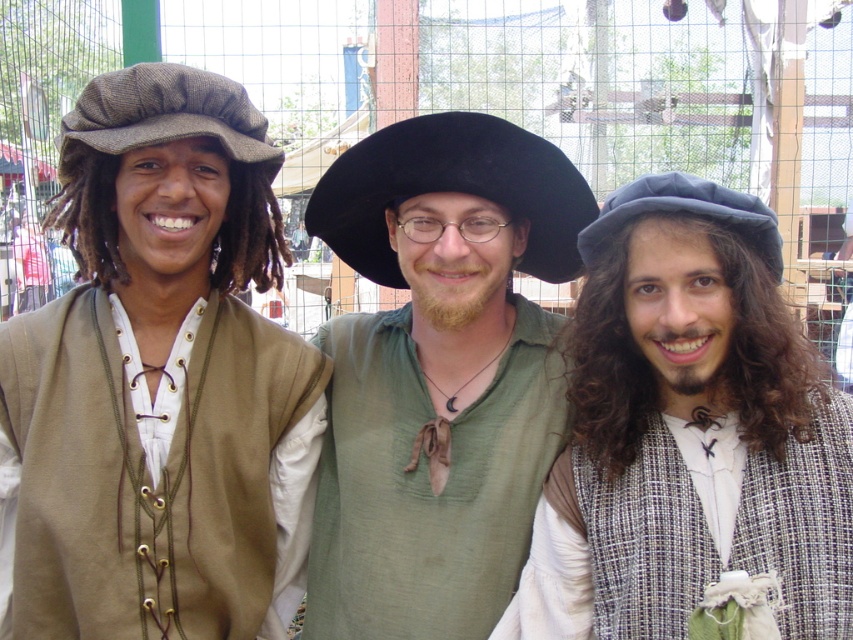
Question: Is matte green vest at center closer to the viewer compared to dark blue fabric hat at center?

Choices:
 (A) no
 (B) yes

Answer: (A)

Question: Which point is closer to the camera?

Choices:
 (A) brown woolen cap at left
 (B) black felt hat at center
 (C) dark blue fabric hat at center

Answer: (C)

Question: Among these points, which one is nearest to the camera?

Choices:
 (A) (741, 227)
 (B) (346, 156)
 (C) (534, 236)

Answer: (A)

Question: Observing the image, what is the correct spatial positioning of brown woolen cap at left in reference to dark blue fabric hat at center?

Choices:
 (A) above
 (B) below

Answer: (A)

Question: Considering the relative positions of matte green vest at center and dark blue fabric hat at center in the image provided, where is matte green vest at center located with respect to dark blue fabric hat at center?

Choices:
 (A) left
 (B) right

Answer: (A)

Question: Which of the following is the farthest from the observer?

Choices:
 (A) (695, 177)
 (B) (463, 198)
 (C) (566, 177)

Answer: (B)